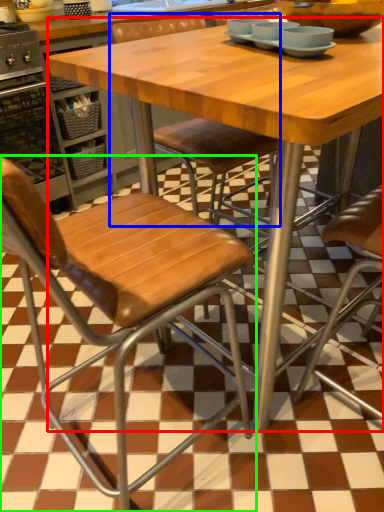
Question: Which is farther away from table (highlighted by a red box)? chair (highlighted by a blue box) or chair (highlighted by a green box)?

Choices:
 (A) chair
 (B) chair

Answer: (A)